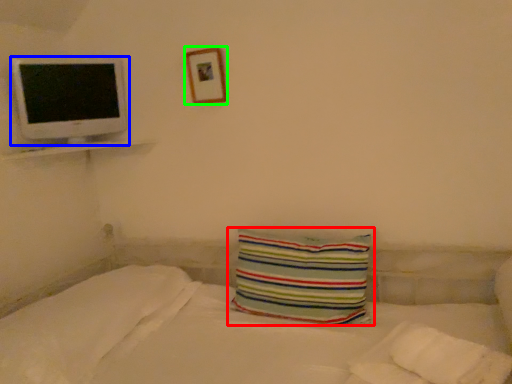
Question: Which object is the farthest from pillow (highlighted by a red box)? Choose among these: computer monitor (highlighted by a blue box) or picture frame (highlighted by a green box).

Choices:
 (A) computer monitor
 (B) picture frame

Answer: (A)